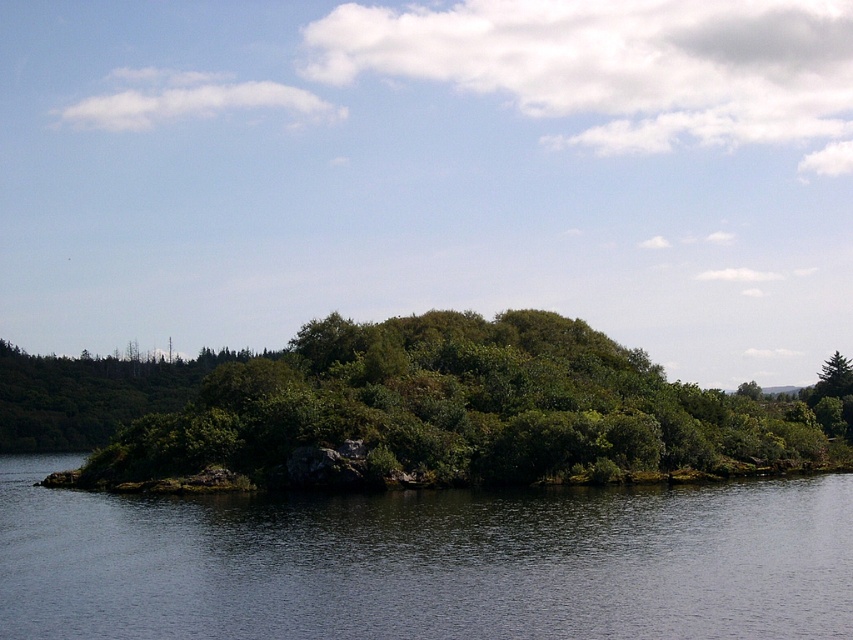
You are a drone operator flying over the island. Your task is to locate the transparent water at center. According to the coordinates provided, where would you direct your drone to focus?

The transparent water at center is located at point (426, 561).

You are a drone operator trying to capture a photo of the transparent water at center and the green leafy bush at center from above. Which object will appear smaller in the photo?

The transparent water at center will appear smaller in the photo because it has a smaller size compared to the green leafy bush at center.

You are standing on the island and want to reach the green leafy bush at center. Which direction should you move to avoid the transparent water at center?

You should move to the right to avoid the transparent water at center, as the transparent water at center is located to the left of the green leafy bush at center.